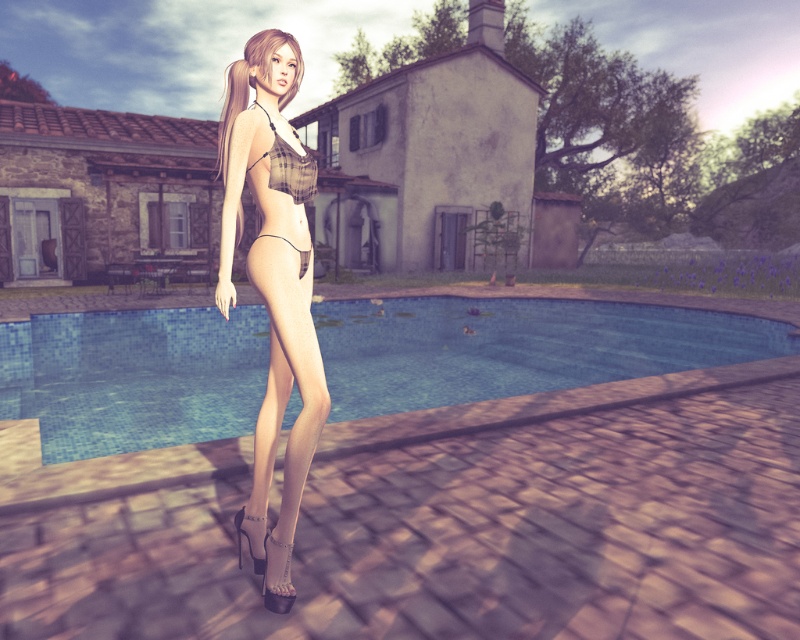
Question: Which point is closer to the camera taking this photo?

Choices:
 (A) (308, 163)
 (B) (302, 61)
 (C) (296, 262)
 (D) (390, 372)

Answer: (C)

Question: Among these points, which one is farthest from the camera?

Choices:
 (A) (616, 330)
 (B) (262, 236)
 (C) (308, 193)

Answer: (A)

Question: Does blue tile pool at center appear on the left side of plaid fabric bikini top at center?

Choices:
 (A) no
 (B) yes

Answer: (A)

Question: Which object is closer to the camera taking this photo?

Choices:
 (A) plaid fabric bikini top at center
 (B) matte black bikini at center
 (C) blue tile pool at center
 (D) matte plaid bikini at center

Answer: (D)

Question: Can you confirm if blue tile pool at center is positioned to the left of clear plastic thong at center?

Choices:
 (A) yes
 (B) no

Answer: (B)

Question: Does blue tile pool at center appear on the right side of clear plastic thong at center?

Choices:
 (A) no
 (B) yes

Answer: (B)